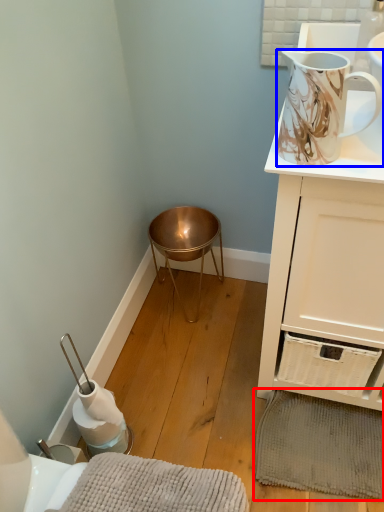
Question: Which object is further to the camera taking this photo, bath mat (highlighted by a red box) or jug (highlighted by a blue box)?

Choices:
 (A) bath mat
 (B) jug

Answer: (A)